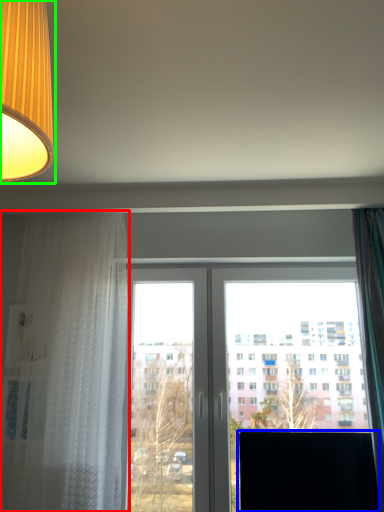
Question: Which object is the closest to the curtain (highlighted by a red box)? Choose among these: computer monitor (highlighted by a blue box) or lamp (highlighted by a green box).

Choices:
 (A) computer monitor
 (B) lamp

Answer: (A)